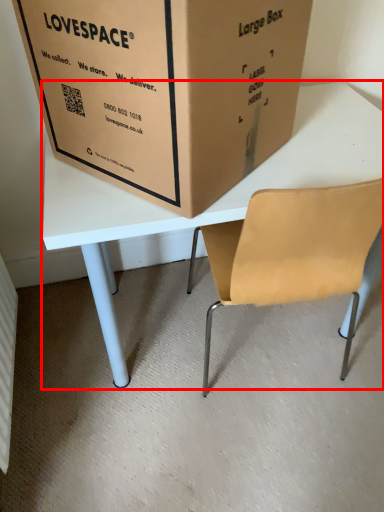
Question: In this image, where is table (annotated by the red box) located relative to box?

Choices:
 (A) left
 (B) right

Answer: (B)